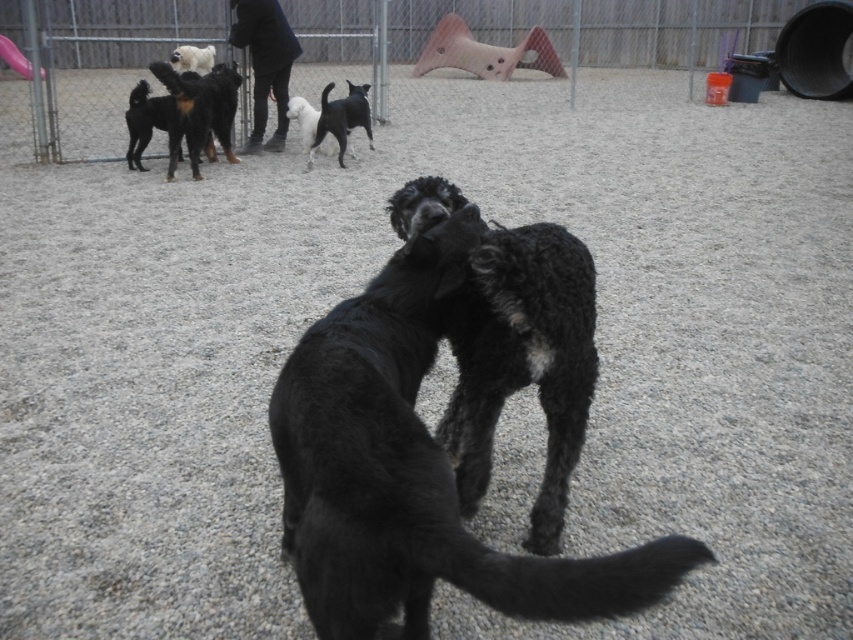
Question: Is shaggy black dog at center positioned at the back of black matte dog at upper center?

Choices:
 (A) no
 (B) yes

Answer: (A)

Question: Does metal fence at upper center have a smaller size compared to shaggy black dog at center?

Choices:
 (A) yes
 (B) no

Answer: (B)

Question: Which object appears farthest from the camera in this image?

Choices:
 (A) black matte dog at upper center
 (B) metal fence at upper center

Answer: (B)

Question: Which object appears closest to the camera in this image?

Choices:
 (A) black curly fur dog at center
 (B) black shaggy dog at upper left
 (C) white fluffy dog at center
 (D) black matte dog at upper center

Answer: (A)

Question: Does black shaggy dog at upper left have a greater width compared to white fluffy dog at upper left?

Choices:
 (A) no
 (B) yes

Answer: (B)

Question: Which is nearer to the metal fence at upper center?

Choices:
 (A) shaggy black dog at center
 (B) white fluffy dog at center
 (C) black shaggy dog at upper left

Answer: (B)